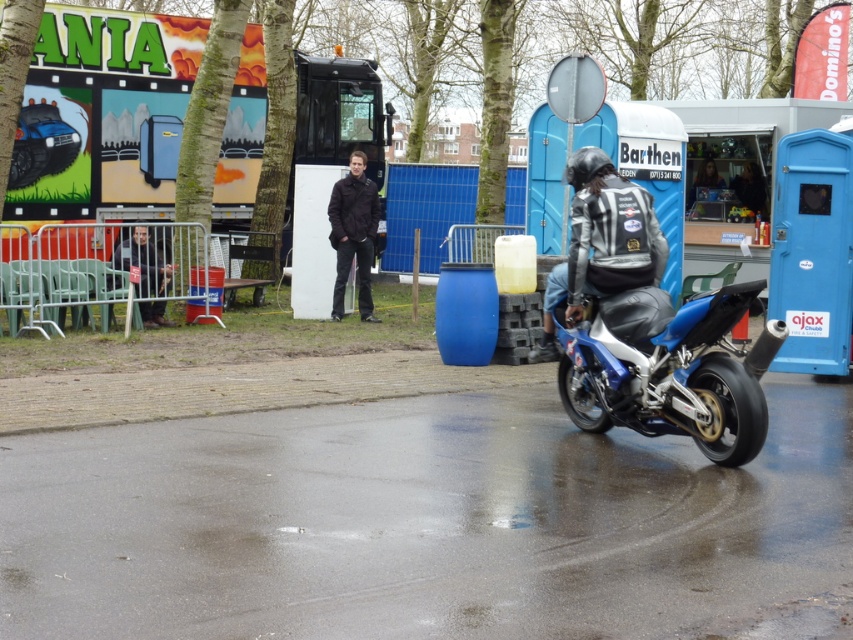
Question: Does matte black truck at upper center have a larger size compared to dark gray fabric jacket at left?

Choices:
 (A) no
 (B) yes

Answer: (A)

Question: Which point appears farthest from the camera in this image?

Choices:
 (A) (573, 269)
 (B) (361, 212)

Answer: (B)

Question: Which point is closer to the camera?

Choices:
 (A) shiny black jacket at center
 (B) dark gray fabric jacket at left

Answer: (A)

Question: Estimate the real-world distances between objects in this image. Which object is closer to the blue metallic motorcycle at lower right?

Choices:
 (A) shiny black jacket at center
 (B) dark brown leather jacket at center
 (C) matte black truck at upper center
 (D) dark gray fabric jacket at left

Answer: (A)

Question: From the image, what is the correct spatial relationship of matte black truck at upper center in relation to dark brown leather jacket at center?

Choices:
 (A) left
 (B) right

Answer: (A)

Question: Does blue metallic motorcycle at lower right appear on the left side of dark brown leather jacket at center?

Choices:
 (A) no
 (B) yes

Answer: (A)